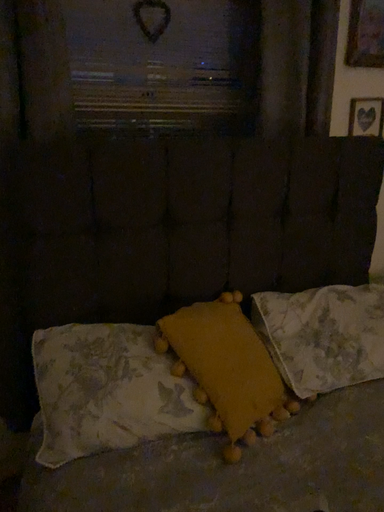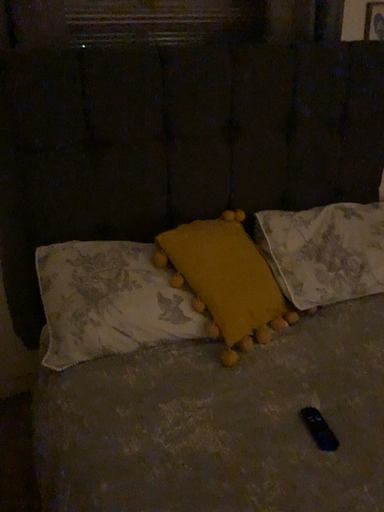
Question: Which way did the camera rotate in the video?

Choices:
 (A) rotated upward
 (B) rotated downward

Answer: (B)